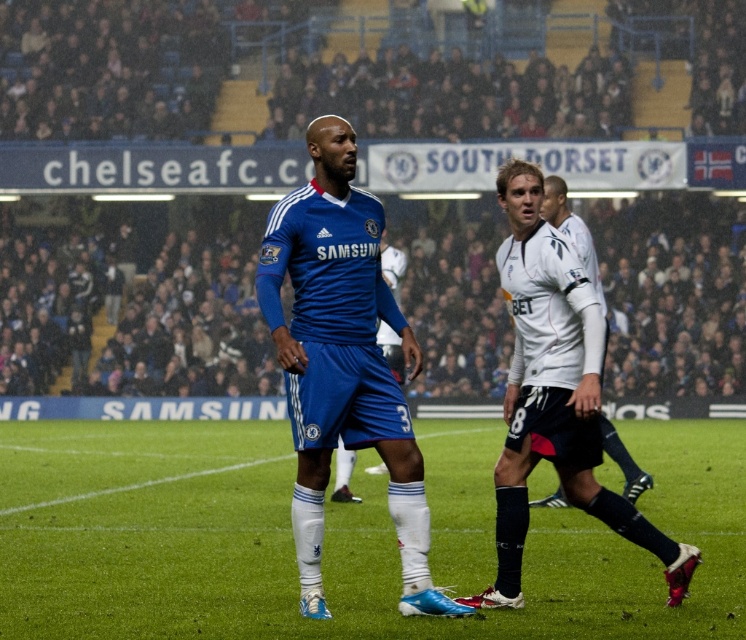
Question: Which point is farther from the camera taking this photo?

Choices:
 (A) (568, 216)
 (B) (515, 195)

Answer: (A)

Question: Among these objects, which one is farthest from the camera?

Choices:
 (A) blue jersey at center
 (B) white jersey at center

Answer: (B)

Question: Can you confirm if blue jersey at center is smaller than white jersey at center?

Choices:
 (A) no
 (B) yes

Answer: (A)

Question: Does white smooth jersey at center appear on the left side of white jersey at center?

Choices:
 (A) yes
 (B) no

Answer: (A)

Question: Does white smooth jersey at center appear over white jersey at center?

Choices:
 (A) no
 (B) yes

Answer: (B)

Question: Which point is closer to the camera?

Choices:
 (A) blue jersey at center
 (B) white smooth jersey at center
 (C) white jersey at center

Answer: (A)